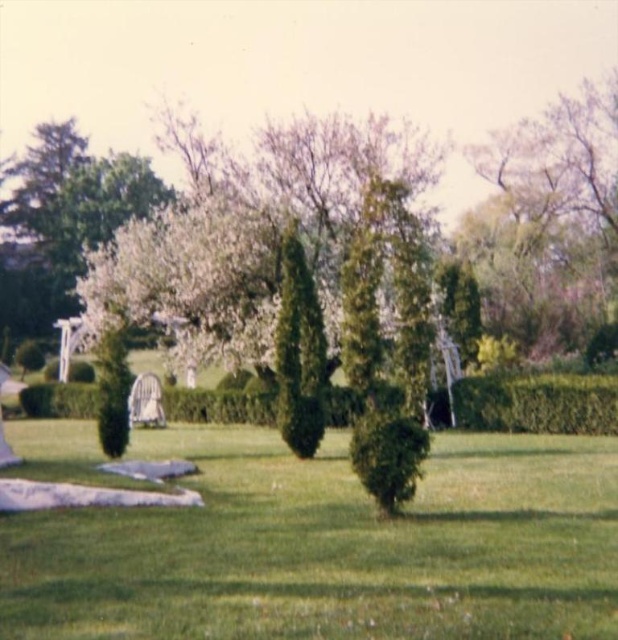
You are standing in the garden looking at the scene. Where is the green leafy tree at upper right located in terms of coordinates?

The green leafy tree at upper right is located at coordinates point (556, 214).

You are standing in the garden looking at the green leafy tree at upper right and the green leafy hedge at center. Which one is positioned more to the right side of the garden?

The green leafy tree at upper right is positioned more to the right side of the garden than the green leafy hedge at center.